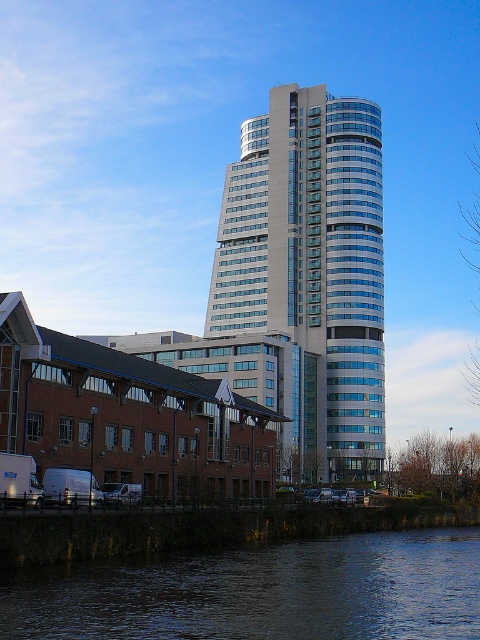
Does glassy white skyscraper at center appear on the left side of dark blue water at lower center?

No, glassy white skyscraper at center is not to the left of dark blue water at lower center.

The height and width of the screenshot is (640, 480). In order to click on glassy white skyscraper at center in this screenshot , I will do `click(312, 262)`.